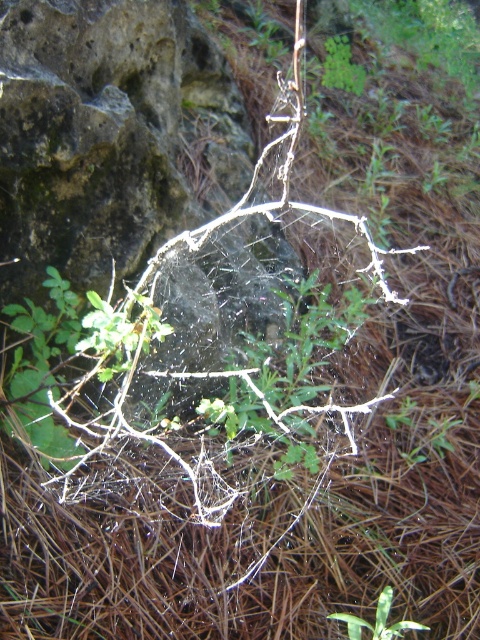
You are an observer looking at the spider web scene. You notice two green leafy plants in the image. Which one is closer to you, the green leafy plant at upper center or the green leafy plant at center?

The green leafy plant at upper center is closer to you because the green leafy plant at center is behind it.

You are an observer looking at the spider web scene. There are two green leafy plants in the image. Which one is taller, the green leafy plant at upper center or the green leafy plant at center?

The green leafy plant at upper center is much taller than the green leafy plant at center.